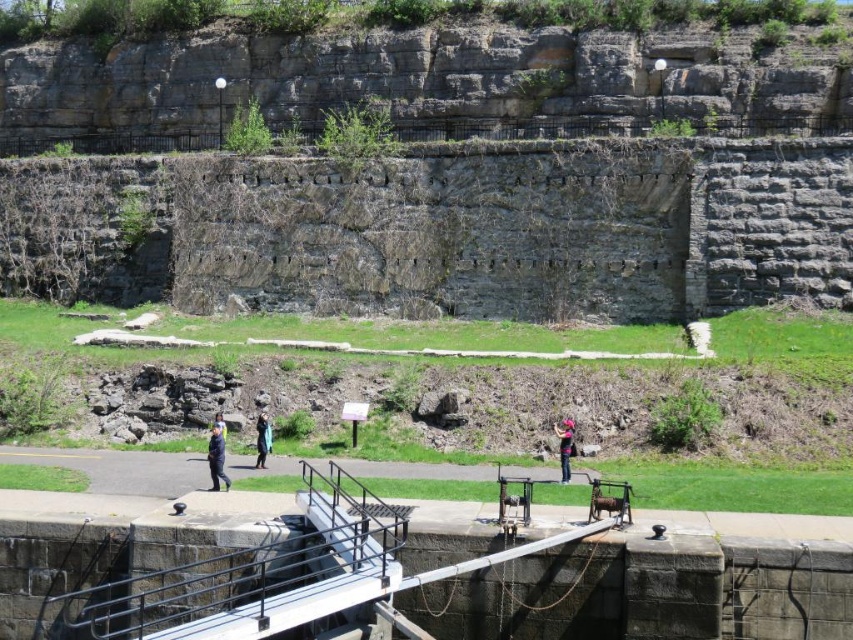
Which is behind, point (213, 452) or point (567, 456)?

Point (567, 456)

Which is in front, point (213, 460) or point (572, 442)?

Point (213, 460) is more forward.

Image resolution: width=853 pixels, height=640 pixels. I want to click on blue fabric jacket at lower left, so click(x=216, y=458).

Who is more distant from viewer, [213,472] or [268,433]?

The point [268,433] is behind.

Is the position of blue fabric jacket at lower left less distant than that of blue denim jacket at center?

Yes.

The width and height of the screenshot is (853, 640). What do you see at coordinates (216, 458) in the screenshot?
I see `blue fabric jacket at lower left` at bounding box center [216, 458].

At what (x,y) coordinates should I click in order to perform the action: click on blue fabric jacket at lower left. Please return your answer as a coordinate pair (x, y). The height and width of the screenshot is (640, 853). Looking at the image, I should click on (216, 458).

Based on the photo, is pink fabric at lower center above blue denim jacket at center?

Actually, pink fabric at lower center is below blue denim jacket at center.

Based on the photo, does pink fabric at lower center have a greater height compared to blue denim jacket at center?

No, pink fabric at lower center is not taller than blue denim jacket at center.

Who is more forward, [567,436] or [256,456]?

Point [567,436]

The height and width of the screenshot is (640, 853). I want to click on pink fabric at lower center, so click(x=566, y=445).